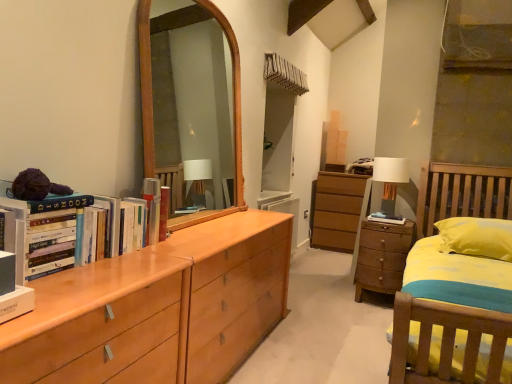
Looking at this image, measure the distance between point (387, 210) and camera.

They are 3.78 meters apart.

Identify the location of white fabric lampshade at right. (388, 182).

The width and height of the screenshot is (512, 384). What do you see at coordinates (388, 182) in the screenshot?
I see `white fabric lampshade at right` at bounding box center [388, 182].

This screenshot has width=512, height=384. What do you see at coordinates (382, 256) in the screenshot?
I see `wooden chest of drawers at right` at bounding box center [382, 256].

You are a GUI agent. You are given a task and a screenshot of the screen. Output one action in this format:
    pyautogui.click(x=<x>, y=<y>)
    Task: Click on the wooden chest of drawers at right
    Image resolution: width=512 pixels, height=384 pixels.
    Given the screenshot: What is the action you would take?
    pyautogui.click(x=382, y=256)

The height and width of the screenshot is (384, 512). I want to click on white fabric lampshade at right, so click(x=388, y=182).

Is wooden chest of drawers at right to the right of white fabric lampshade at right from the viewer's perspective?

No, wooden chest of drawers at right is not to the right of white fabric lampshade at right.

In the image, is wooden chest of drawers at right positioned in front of or behind white fabric lampshade at right?

Visually, wooden chest of drawers at right is located in front of white fabric lampshade at right.

Does point (398, 250) appear closer or farther from the camera than point (380, 171)?

Point (398, 250) is closer to the camera than point (380, 171).

From the image's perspective, which object appears higher, wooden chest of drawers at right or white fabric lampshade at right?

white fabric lampshade at right, from the image's perspective.

From a real-world perspective, which object rests below the other?

In real-world perspective, wooden chest of drawers at right is lower.

Looking at their sizes, would you say wooden chest of drawers at right is wider or thinner than white fabric lampshade at right?

Clearly, wooden chest of drawers at right has more width compared to white fabric lampshade at right.

In terms of height, does wooden chest of drawers at right look taller or shorter compared to white fabric lampshade at right?

wooden chest of drawers at right is taller than white fabric lampshade at right.

From the picture: Is wooden chest of drawers at right bigger than white fabric lampshade at right?

Yes.

Is wooden chest of drawers at right outside of white fabric lampshade at right?

That's correct, wooden chest of drawers at right is outside of white fabric lampshade at right.

Is wooden chest of drawers at right in contact with white fabric lampshade at right?

No.

Could you tell me if wooden chest of drawers at right is turned towards white fabric lampshade at right?

No, wooden chest of drawers at right is not oriented towards white fabric lampshade at right.

How different are the orientations of wooden chest of drawers at right and white fabric lampshade at right in degrees?

They differ by 0.00263 degrees in their facing directions.

From the picture: Measure the distance between wooden chest of drawers at right and white fabric lampshade at right.

They are 16.13 inches apart.

Identify the location of the chest of drawers that appears in front of the white fabric lampshade at right. The height and width of the screenshot is (384, 512). (382, 256).

Is white fabric lampshade at right to the left or to the right of wooden chest of drawers at right in the image?

white fabric lampshade at right is positioned on wooden chest of drawers at right's right side.

Is the position of white fabric lampshade at right more distant than that of wooden chest of drawers at right?

Yes, the depth of white fabric lampshade at right is greater than that of wooden chest of drawers at right.

Is point (387, 159) closer to camera compared to point (399, 248)?

No, (387, 159) is behind (399, 248).

In the scene shown: From the image's perspective, is white fabric lampshade at right located beneath wooden chest of drawers at right?

Incorrect, from the image's perspective, white fabric lampshade at right is higher than wooden chest of drawers at right.

From a real-world perspective, who is located higher, white fabric lampshade at right or wooden chest of drawers at right?

In real-world perspective, white fabric lampshade at right is above.

Does white fabric lampshade at right have a lesser width compared to wooden chest of drawers at right?

Indeed, white fabric lampshade at right has a lesser width compared to wooden chest of drawers at right.

Who is shorter, white fabric lampshade at right or wooden chest of drawers at right?

white fabric lampshade at right.

Which of these two, white fabric lampshade at right or wooden chest of drawers at right, is smaller?

With smaller size is white fabric lampshade at right.

Is white fabric lampshade at right spatially inside wooden chest of drawers at right, or outside of it?

white fabric lampshade at right is not enclosed by wooden chest of drawers at right.

Is the surface of white fabric lampshade at right in direct contact with wooden chest of drawers at right?

white fabric lampshade at right is not next to wooden chest of drawers at right, and they're not touching.

Is white fabric lampshade at right facing away from wooden chest of drawers at right?

No, white fabric lampshade at right's orientation is not away from wooden chest of drawers at right.

Where is `table lamp on the right of wooden chest of drawers at right`? table lamp on the right of wooden chest of drawers at right is located at coordinates (388, 182).

Find the location of a particular element. The width and height of the screenshot is (512, 384). table lamp behind the wooden chest of drawers at right is located at coordinates (388, 182).

This screenshot has height=384, width=512. What are the coordinates of `the chest of drawers below the white fabric lampshade at right (from a real-world perspective)` in the screenshot? It's located at (382, 256).